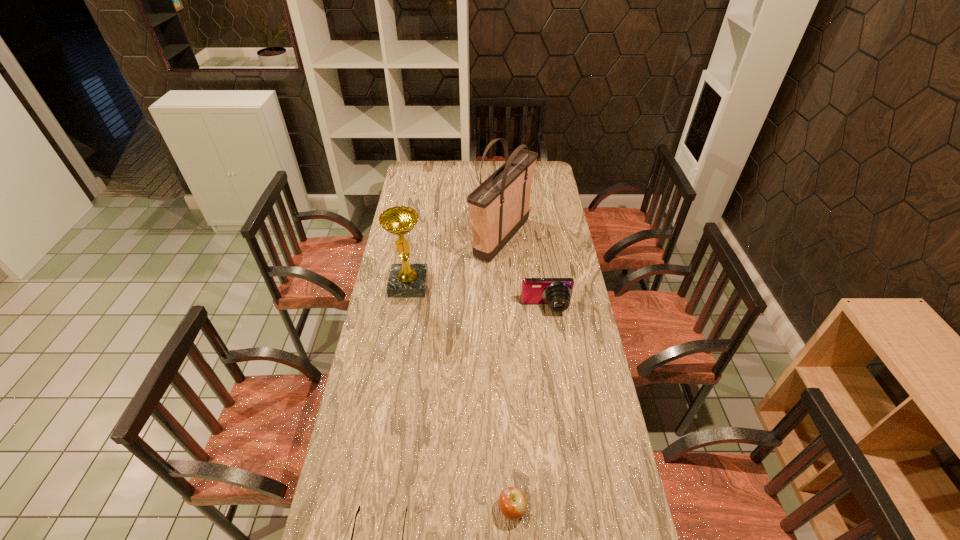
This screenshot has width=960, height=540. What are the coordinates of `empty space that is in between the apple and the award` in the screenshot? It's located at (461, 397).

The height and width of the screenshot is (540, 960). Find the location of `free space between the second farthest object and the shopping bag`. free space between the second farthest object and the shopping bag is located at coordinates (455, 261).

Identify which object is located as the fourth nearest to the second shortest object. Please provide its 2D coordinates. Your answer should be formatted as a tuple, i.e. [(x, y)], where the tuple contains the x and y coordinates of a point satisfying the conditions above.

[(499, 207)]

Choose which object is the third nearest neighbor to the camera. Please provide its 2D coordinates. Your answer should be formatted as a tuple, i.e. [(x, y)], where the tuple contains the x and y coordinates of a point satisfying the conditions above.

[(513, 503)]

Find the location of a particular element. The width and height of the screenshot is (960, 540). free location that satisfies the following two spatial constraints: 1. on the front-facing side of the award; 2. on the left side of the second shortest object is located at coordinates (372, 509).